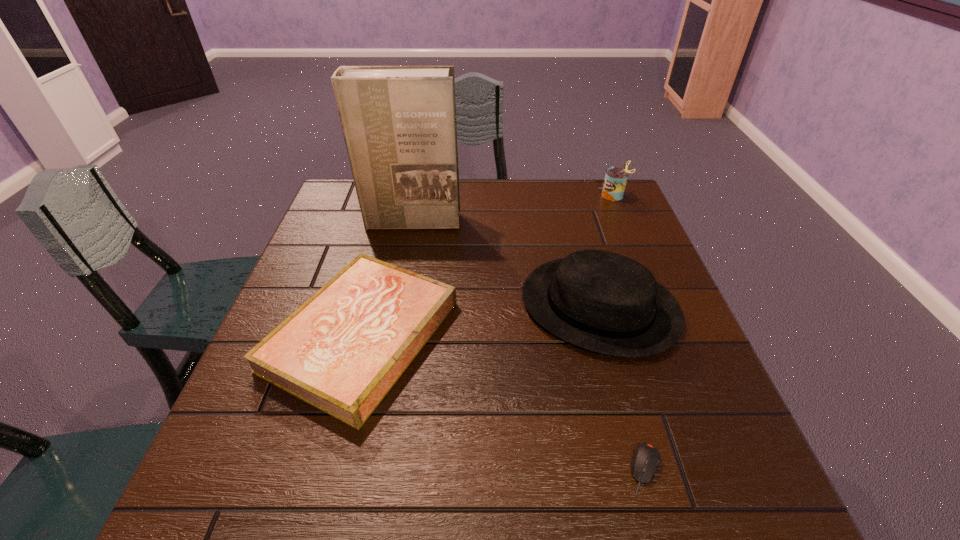
The width and height of the screenshot is (960, 540). In order to click on vacant space situated on the right of the fourth tallest object in this screenshot , I will do `click(607, 336)`.

Locate an element on the screen. Image resolution: width=960 pixels, height=540 pixels. vacant space located on the left of the nearest object is located at coordinates (398, 468).

Image resolution: width=960 pixels, height=540 pixels. In order to click on phonebook present at the far edge in this screenshot , I will do `click(399, 124)`.

The height and width of the screenshot is (540, 960). In order to click on can present at the far edge in this screenshot , I will do `click(614, 184)`.

Where is `object present at the near edge`? This screenshot has width=960, height=540. object present at the near edge is located at coordinates (646, 459).

Where is `phonebook situated at the left edge`? Image resolution: width=960 pixels, height=540 pixels. phonebook situated at the left edge is located at coordinates (399, 124).

I want to click on hardback book that is at the left edge, so click(341, 351).

Locate an element on the screen. The image size is (960, 540). can at the right edge is located at coordinates (614, 184).

Where is `fedora that is at the right edge`? fedora that is at the right edge is located at coordinates (600, 301).

Where is `computer mouse that is at the right edge`? Image resolution: width=960 pixels, height=540 pixels. computer mouse that is at the right edge is located at coordinates (646, 459).